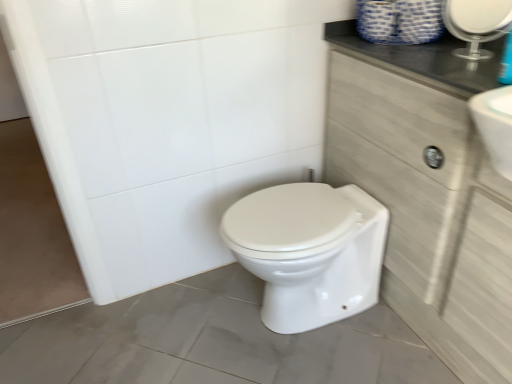
The width and height of the screenshot is (512, 384). In order to click on vacant region below white glossy bidet at center (from a real-world perspective) in this screenshot , I will do `click(293, 326)`.